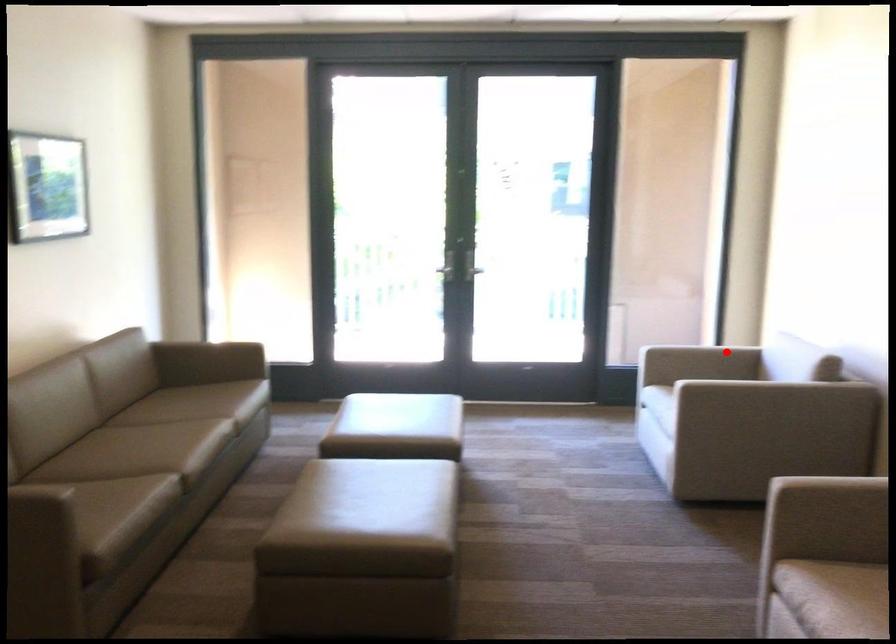
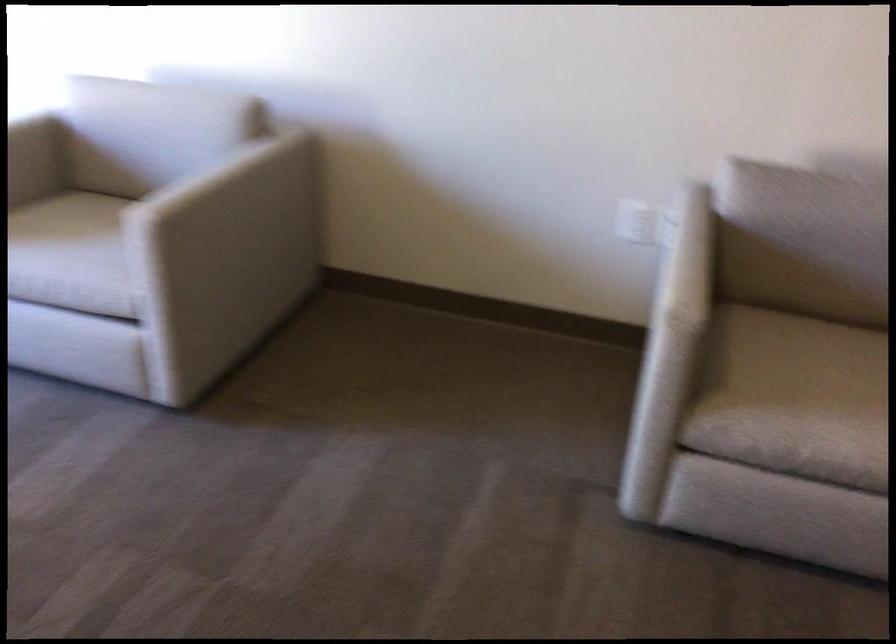
Question: I am providing you with two images of the same scene from different viewpoints. Given a red point in image1, look at the same physical point in image2. Is it:

Choices:
 (A) Closer to the viewpoint
 (B) Farther from the viewpoint

Answer: (A)